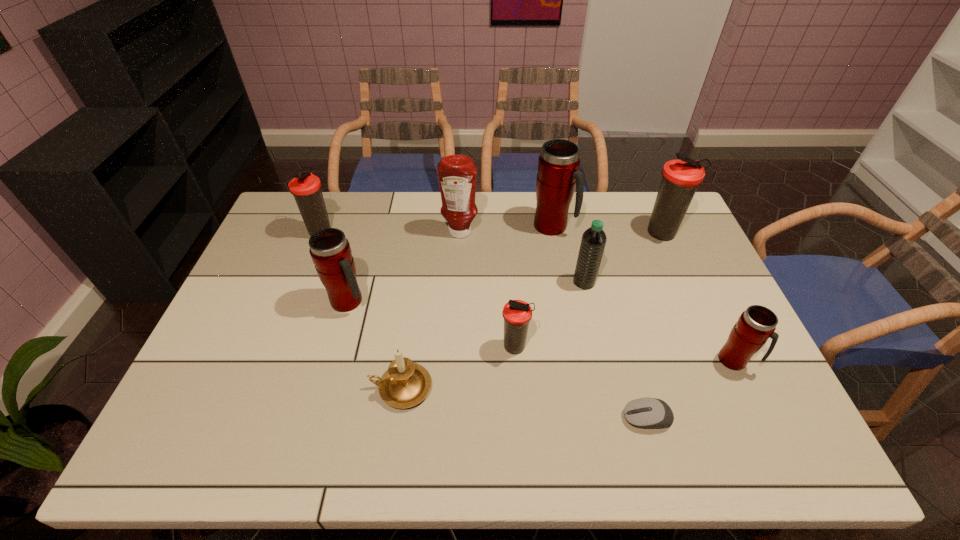
Where is `the rightmost brown thermos bottle`? Image resolution: width=960 pixels, height=540 pixels. the rightmost brown thermos bottle is located at coordinates (680, 178).

At what (x,y) coordinates should I click in order to perform the action: click on the third thermos bottle from right to left. Please return your answer as a coordinate pair (x, y). The image size is (960, 540). Looking at the image, I should click on (558, 175).

Find the location of `the biggest red thermos bottle`. the biggest red thermos bottle is located at coordinates (558, 175).

The image size is (960, 540). I want to click on red condiment, so click(457, 174).

Identify the location of the leftmost object. The height and width of the screenshot is (540, 960). (306, 188).

Locate an element on the screen. Image resolution: width=960 pixels, height=540 pixels. the second smallest brown thermos bottle is located at coordinates (306, 188).

Where is `the ninth object from right to left`? The image size is (960, 540). the ninth object from right to left is located at coordinates (330, 251).

In order to click on the second farthest red thermos bottle in this screenshot , I will do `click(330, 251)`.

Locate an element on the screen. The image size is (960, 540). black water bottle is located at coordinates (593, 242).

Locate an element on the screen. The height and width of the screenshot is (540, 960). the fifth object from left to right is located at coordinates (516, 313).